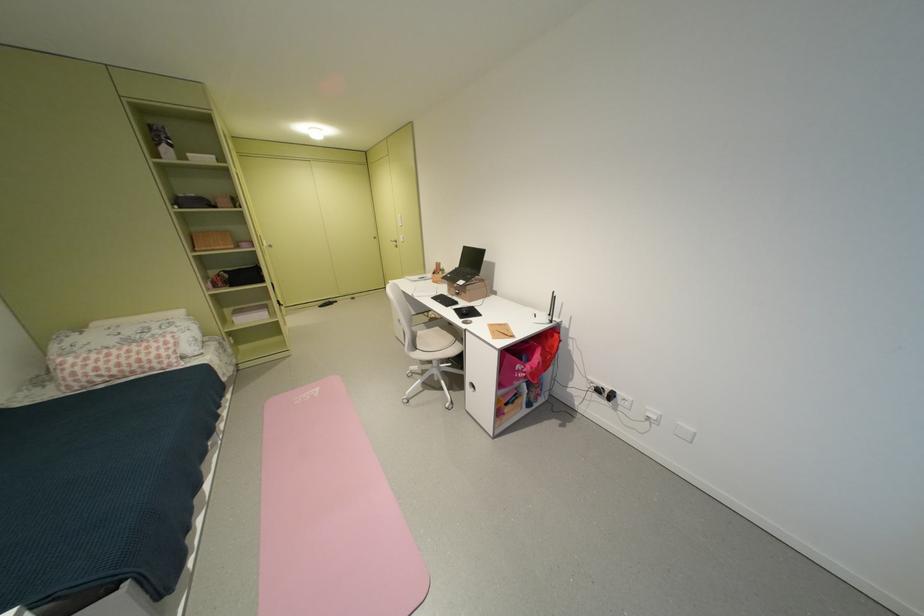
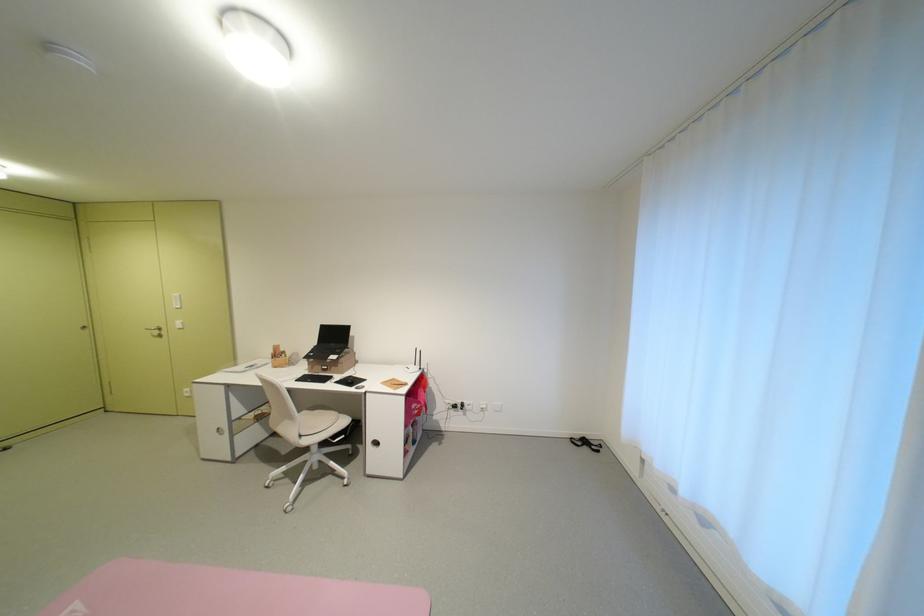
Where in the second image is the point corresponding to the point at 475,294 from the first image?

(346, 368)